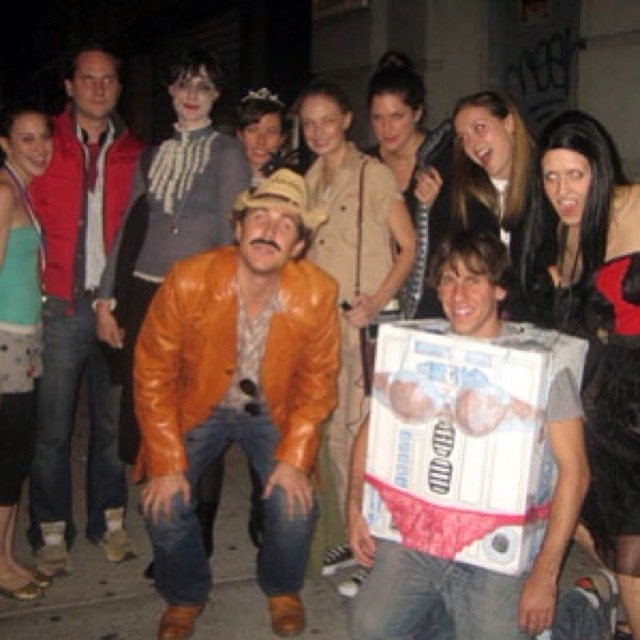
Question: Does orange leather jacket at center have a larger size compared to white cardboard box at center?

Choices:
 (A) yes
 (B) no

Answer: (A)

Question: Does smooth black hair at upper right appear on the left side of matte gray sweater at upper center?

Choices:
 (A) no
 (B) yes

Answer: (A)

Question: Which point is closer to the camera?

Choices:
 (A) click(636, 472)
 (B) click(6, 500)
 (C) click(300, 497)
 (D) click(556, 381)

Answer: (D)

Question: Is teal jersey at center above matte beige dress at center?

Choices:
 (A) no
 (B) yes

Answer: (A)

Question: Which of the following is the farthest from the observer?

Choices:
 (A) (84, 308)
 (B) (243, 96)
 (C) (627, 500)
 (D) (26, 586)

Answer: (B)

Question: Which object appears closest to the camera in this image?

Choices:
 (A) white cardboard box at center
 (B) teal jersey at center
 (C) matte beige dress at center

Answer: (A)